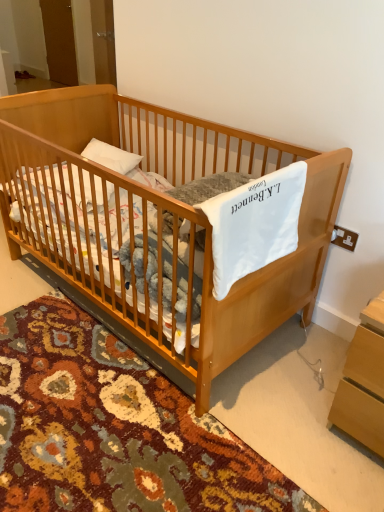
The height and width of the screenshot is (512, 384). Identify the location of free point to the left of light brown wooden changing table at lower right. (287, 405).